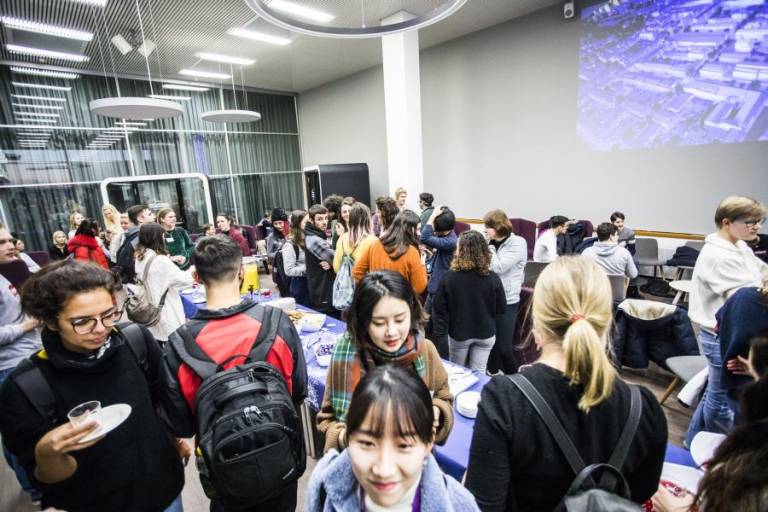
Locate an element on the screen. lighting is located at coordinates (303, 6), (272, 40), (232, 63), (190, 86).